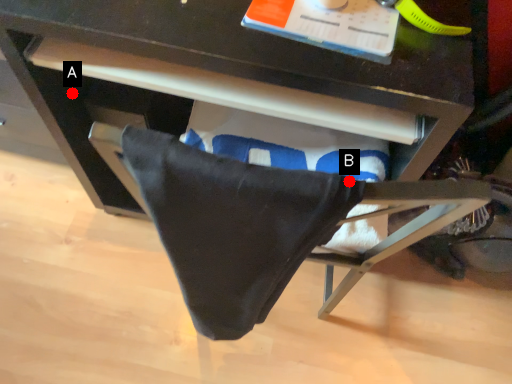
Question: Two points are circled on the image, labeled by A and B beside each circle. Which point is further to the camera?

Choices:
 (A) A is further
 (B) B is further

Answer: (A)